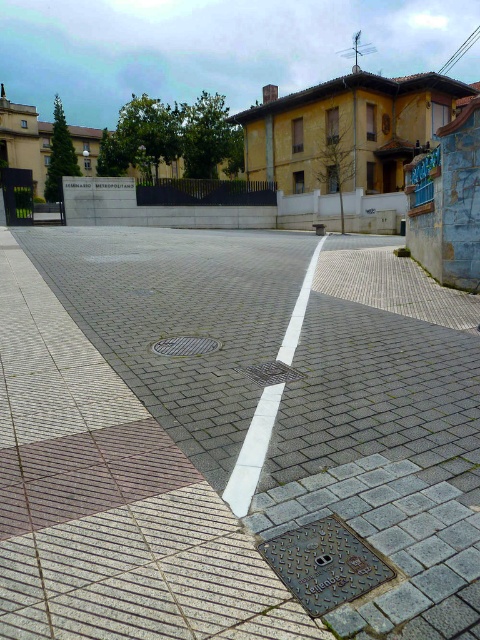
You are standing at the point marked as point (93, 348) and want to walk towards the point marked as point (169, 346). Given the paved area with brick and tiled surfaces and the diagonal white line, will your path cross the white painted line?

The path between point (93, 348) and point (169, 346) would cross the white painted line since both points are on different sides of the diagonal line dividing the paved area.

Based on the photo, you are a delivery person trying to park your bike. You see the gray concrete pavement at center and the metallic grid manhole cover at center. Which surface is more stable for parking your bike?

The gray concrete pavement at center is positioned over the metallic grid manhole cover at center, so the gray concrete pavement at center is more stable for parking the bike since it is a solid surface above the manhole cover.

You are a delivery robot with a 1.5 meter wide package. You need to navigate through the urban scene shown. Can you safely pass between the gray concrete pavement at center and the metallic grid manhole cover at center without hitting the package?

The distance between the gray concrete pavement at center and the metallic grid manhole cover at center is 1.61 meters. Since the package is 1.5 meters wide, there is enough space for the robot to pass safely.